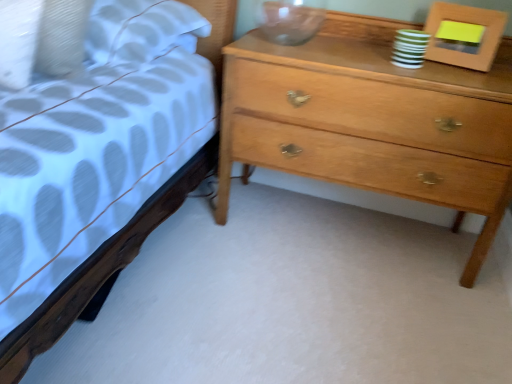
Where is `free space in front of light brown wood chest of drawers at right`? This screenshot has height=384, width=512. free space in front of light brown wood chest of drawers at right is located at coordinates (336, 311).